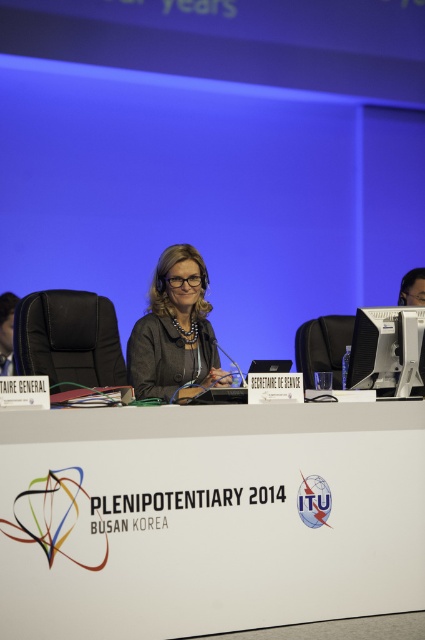
You are organizing a conference and need to place a new object on the table. There is a matte black jacket at center and a sleek black monitor at center. Which object should you move to make space for the new item?

You should move the matte black jacket at center because it might be wider than the sleek black monitor at center, making it easier to accommodate the new object.

You are standing at the entrance of the conference room and want to approach the white plastic table at center. According to the coordinates given, in which direction should you move relative to your current position?

The white plastic table at center is located at coordinates point [209,516]. Since you are at the entrance, you should move towards the direction of the center of the room to reach it.

You are a photographer at the event and need to adjust your camera to focus on both the white plastic table at center and the matte black jacket at center. Which object should you focus on first if you want to ensure the other is also in focus?

The white plastic table at center is much taller than the matte black jacket at center, so focus on the table first to ensure the jacket is also in focus.